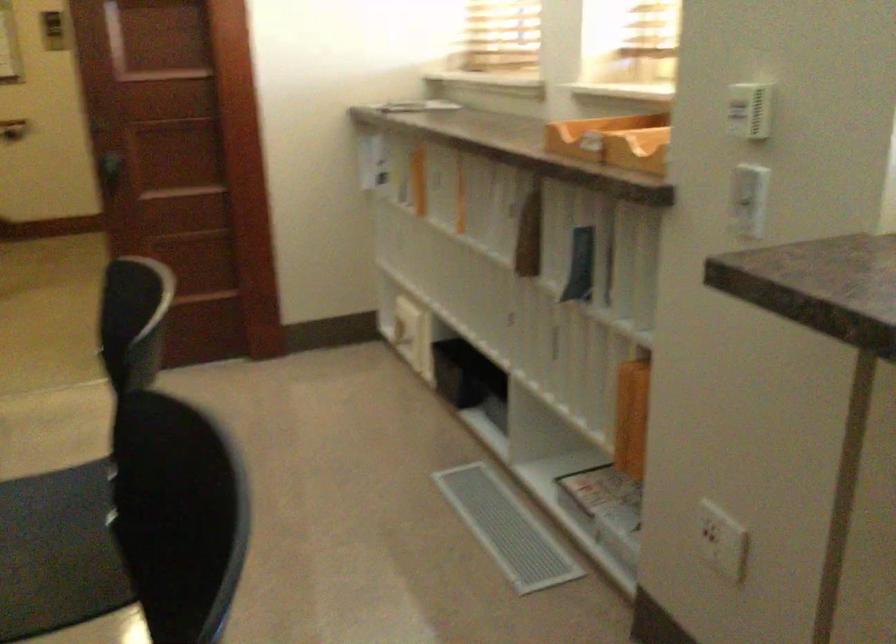
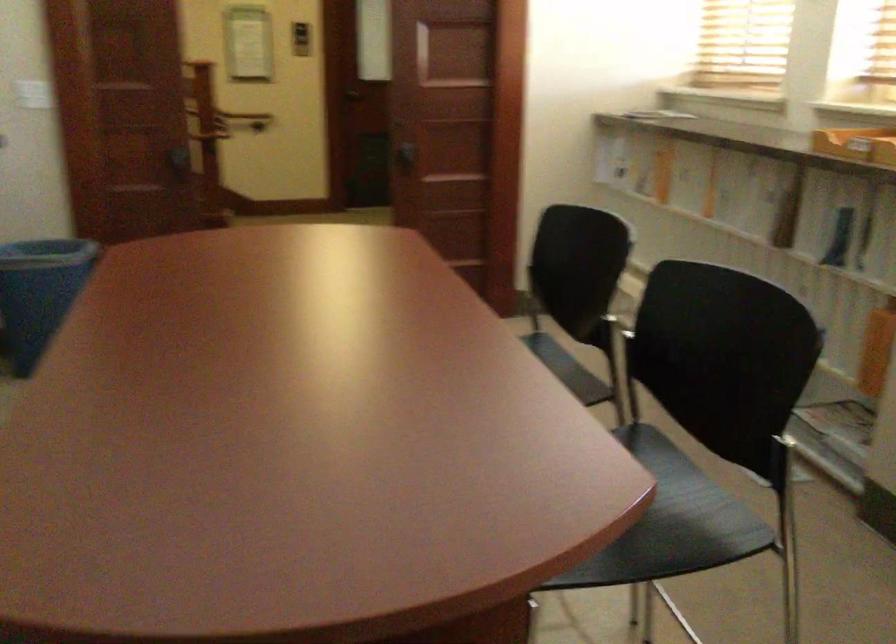
Locate, in the second image, the point that corresponds to the point at 210,135 in the first image.

(460, 133)